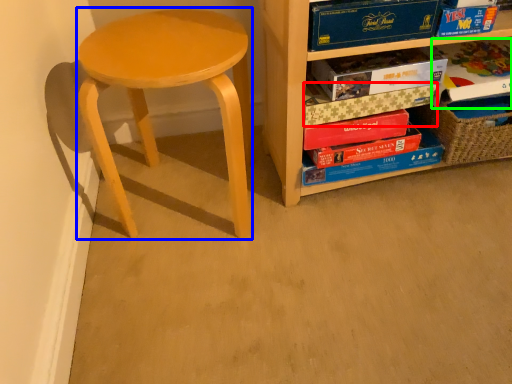
Question: Considering the real-world distances, which object is farthest from paperback book (highlighted by a red box)? stool (highlighted by a blue box) or paperback book (highlighted by a green box)?

Choices:
 (A) stool
 (B) paperback book

Answer: (A)